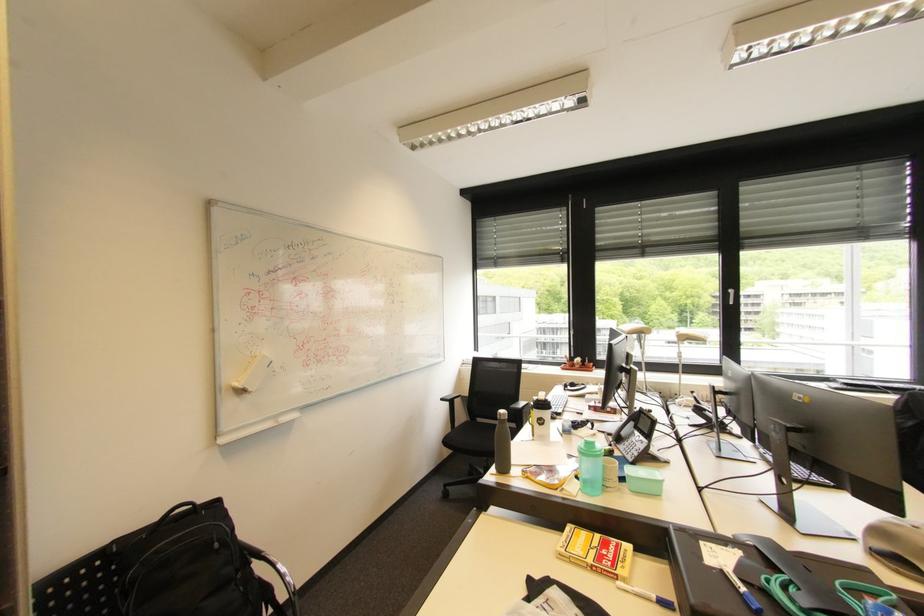
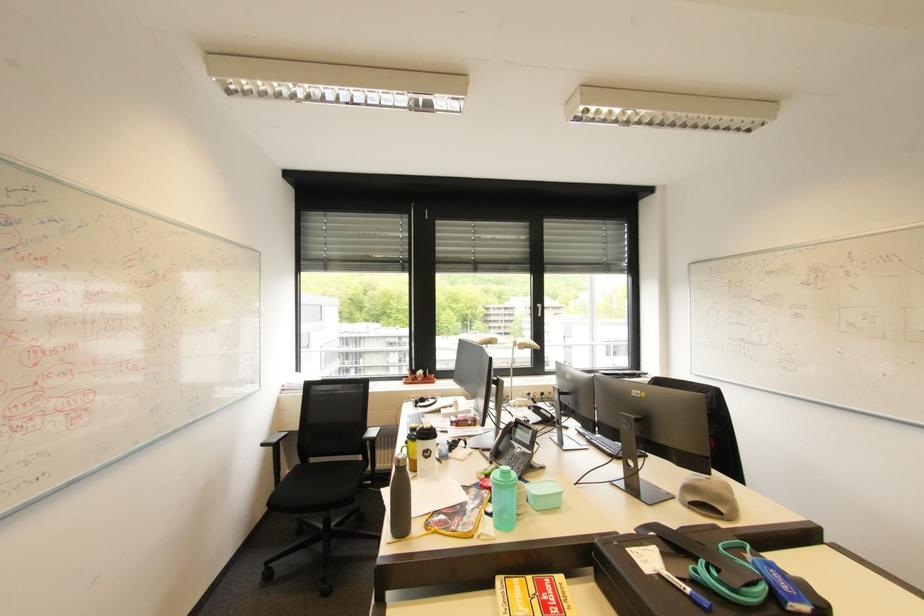
The point at (586,546) is marked in the first image. Where is the corresponding point in the second image?

(526, 602)